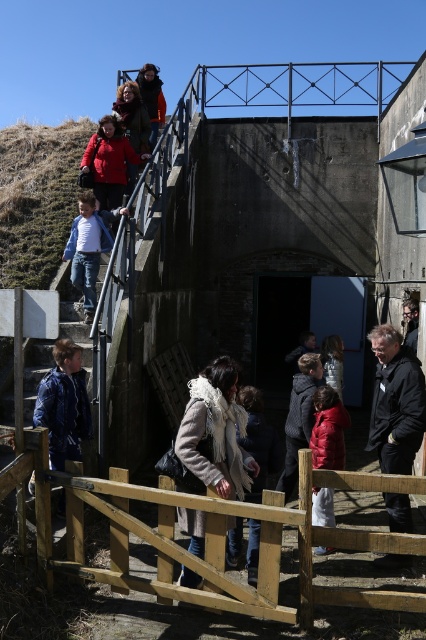
You are standing at the top of the stairs and looking down. You notice two jackets in the scene. Which jacket is positioned higher up, the black matte jacket at lower right or the red matte jacket at lower center?

The black matte jacket at lower right is positioned higher up than the red matte jacket at lower center because it is located above it.

You are a delivery person with a cart that is 2 meters wide. You need to pass through the space between the wooden gate at center and the matte red jacket at upper center. Can your cart fit through this space?

The wooden gate at center and the matte red jacket at upper center are 5.74 meters apart from each other. Since your cart is only 2 meters wide, it can easily fit through the space between them.